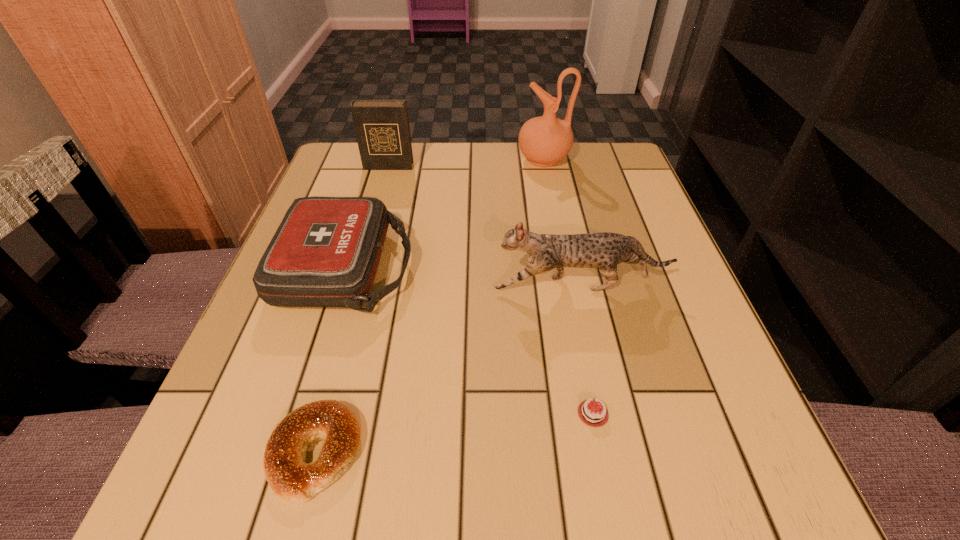
Where is `free spot between the diary and the pottery`? The image size is (960, 540). free spot between the diary and the pottery is located at coordinates (466, 163).

Locate an element on the screen. The image size is (960, 540). vacant area between the bagel and the diary is located at coordinates (351, 309).

Find the location of a particular element. vacant space that's between the fifth tallest object and the cat is located at coordinates (448, 369).

Find the location of a particular element. Image resolution: width=960 pixels, height=540 pixels. object that stands as the fifth closest to the fifth tallest object is located at coordinates (544, 140).

Locate which object ranks fourth in proximity to the pottery. Please provide its 2D coordinates. Your answer should be formatted as a tuple, i.e. [(x, y)], where the tuple contains the x and y coordinates of a point satisfying the conditions above.

[(594, 416)]

I want to click on vacant point that satisfies the following two spatial constraints: 1. on the front side of the third shortest object; 2. on the left side of the chocolate cake, so click(301, 414).

Locate an element on the screen. vacant region that satisfies the following two spatial constraints: 1. on the spout of the tallest object; 2. on the front side of the third shortest object is located at coordinates (564, 268).

Identify the location of free spot that satisfies the following two spatial constraints: 1. on the spout of the pottery; 2. on the front side of the shortest object. (593, 414).

Where is `vacant point that satisfies the following two spatial constraints: 1. on the spout of the pottery; 2. on the front cover of the diary`? This screenshot has width=960, height=540. vacant point that satisfies the following two spatial constraints: 1. on the spout of the pottery; 2. on the front cover of the diary is located at coordinates (545, 166).